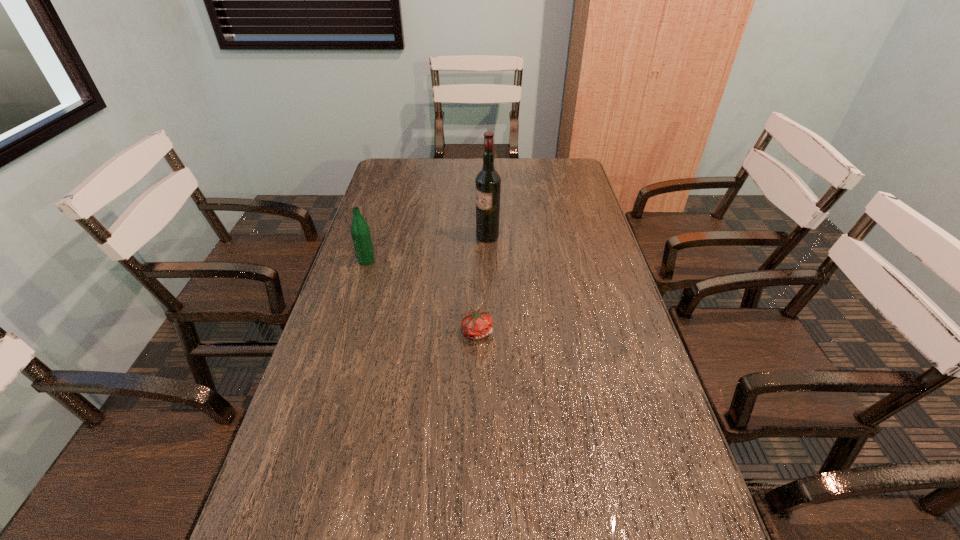
Locate an element on the screen. Image resolution: width=960 pixels, height=540 pixels. the tallest object is located at coordinates (488, 181).

The width and height of the screenshot is (960, 540). I want to click on wine bottle, so click(x=488, y=181).

Where is `the second shortest object`? the second shortest object is located at coordinates (360, 231).

Where is `the second farthest object`? the second farthest object is located at coordinates (360, 231).

The width and height of the screenshot is (960, 540). I want to click on the shortest object, so click(x=476, y=325).

I want to click on the nearest object, so click(x=476, y=325).

Where is `vacant region located 0.340m on the front and back of the wine bottle`? The height and width of the screenshot is (540, 960). vacant region located 0.340m on the front and back of the wine bottle is located at coordinates (376, 237).

This screenshot has height=540, width=960. Find the location of `vacant space located 0.300m on the front and back of the wine bottle`. vacant space located 0.300m on the front and back of the wine bottle is located at coordinates (388, 237).

At what (x,y) coordinates should I click in order to perform the action: click on vacant space situated 0.330m on the front and back of the wine bottle. Please return your answer as a coordinate pair (x, y). Image resolution: width=960 pixels, height=540 pixels. Looking at the image, I should click on [x=379, y=237].

Locate an element on the screen. The height and width of the screenshot is (540, 960). vacant space located 0.130m on the back of the second shortest object is located at coordinates (375, 232).